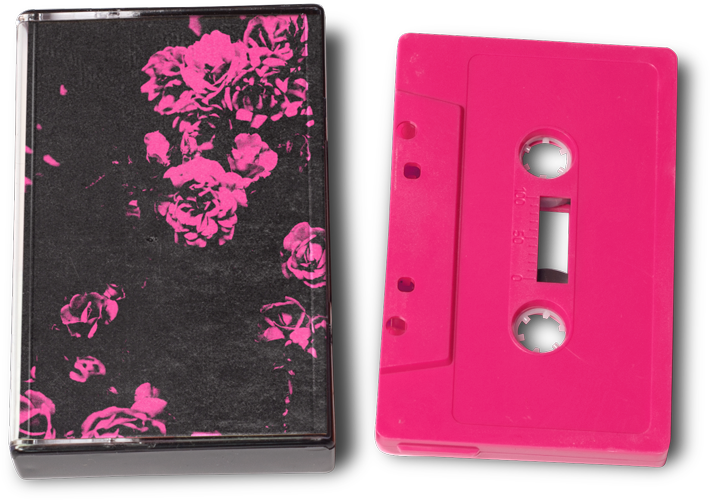
Find the location of a particular element. The image size is (710, 500). hinges is located at coordinates (20, 442), (27, 12).